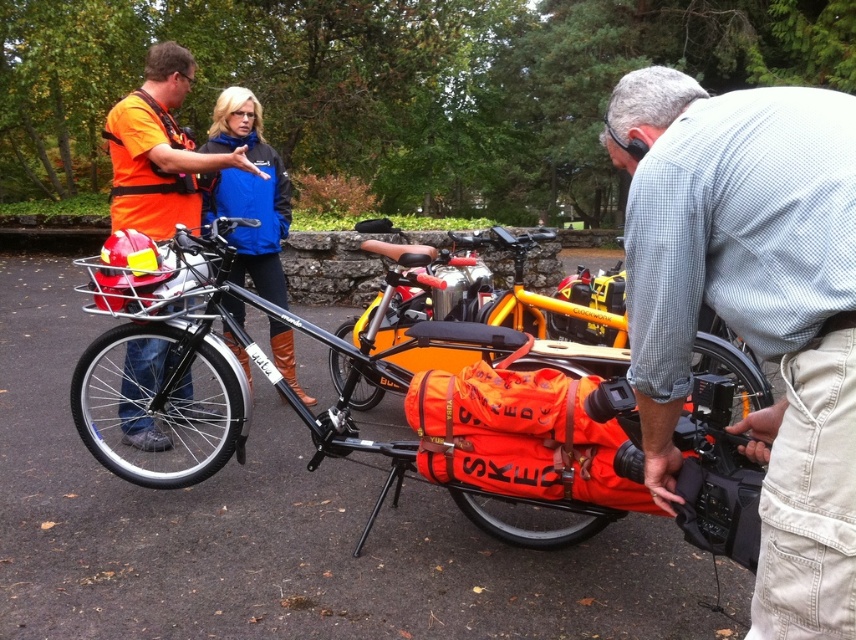
Question: Which object is the farthest from the blue fabric jacket at upper center?

Choices:
 (A) orange fabric cargo bike at center
 (B) orange fabric bag at lower center
 (C) gray checkered shirt at center

Answer: (C)

Question: Among these points, which one is farthest from the camera?

Choices:
 (A) (212, 416)
 (B) (812, 276)

Answer: (A)

Question: Can you confirm if orange life vest at left is positioned below blue fabric jacket at upper center?

Choices:
 (A) yes
 (B) no

Answer: (B)

Question: Can you confirm if gray checkered shirt at center is positioned below orange fabric cargo bike at center?

Choices:
 (A) no
 (B) yes

Answer: (B)

Question: Which point appears closest to the camera in this image?

Choices:
 (A) (159, 380)
 (B) (229, 177)
 (C) (503, 236)
 (D) (851, 204)

Answer: (D)

Question: Is orange fabric bag at lower center thinner than orange life vest at left?

Choices:
 (A) no
 (B) yes

Answer: (A)